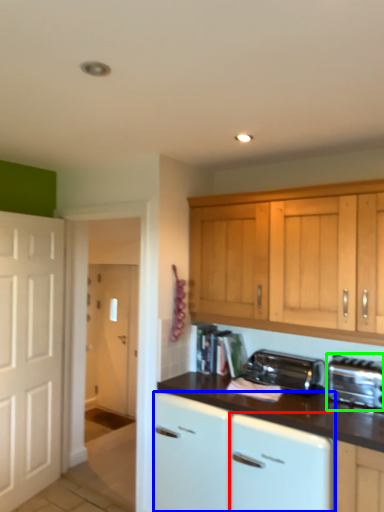
Question: Which is nearer to the dish washer (highlighted by a red box)? cabinetry (highlighted by a blue box) or toaster (highlighted by a green box).

Choices:
 (A) cabinetry
 (B) toaster

Answer: (A)